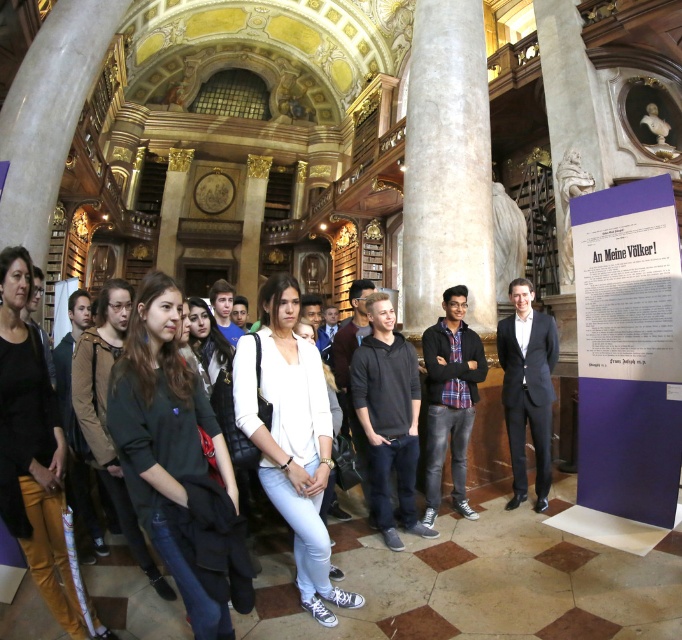
Is point (653, 320) closer to camera compared to point (138, 342)?

That is False.

Who is more distant from viewer, (x=677, y=364) or (x=153, y=518)?

Point (x=677, y=364)

Is point (627, 241) more distant than point (166, 353)?

Yes, point (627, 241) is behind point (166, 353).

Where is `purple paper at center`? This screenshot has width=682, height=640. purple paper at center is located at coordinates (627, 349).

Does purple paper at center appear over white marble pillar at center?

No, purple paper at center is not above white marble pillar at center.

Is purple paper at center to the left of white marble pillar at center from the viewer's perspective?

No, purple paper at center is not to the left of white marble pillar at center.

Where is `purple paper at center`? The image size is (682, 640). purple paper at center is located at coordinates (627, 349).

Image resolution: width=682 pixels, height=640 pixels. What do you see at coordinates (447, 166) in the screenshot?
I see `white marble pillar at center` at bounding box center [447, 166].

The width and height of the screenshot is (682, 640). Identify the location of white marble pillar at center. (447, 166).